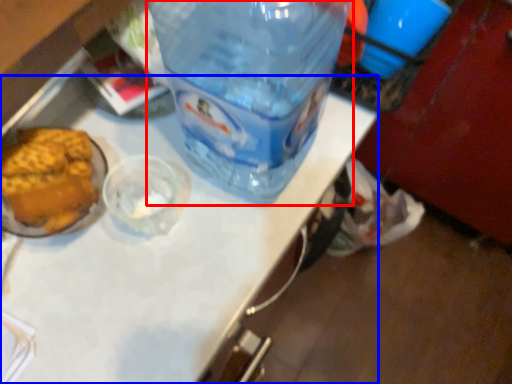
Question: Which object appears closest to the camera in this image, bottle (highlighted by a red box) or table top (highlighted by a blue box)?

Choices:
 (A) bottle
 (B) table top

Answer: (B)